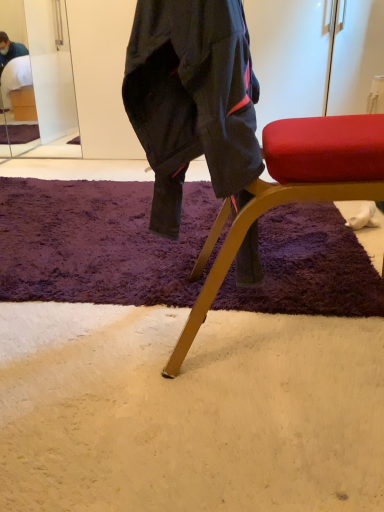
This screenshot has width=384, height=512. What do you see at coordinates (297, 188) in the screenshot?
I see `metallic gold chair at center` at bounding box center [297, 188].

Measure the distance between point (x=124, y=232) and camera.

They are 1.54 meters apart.

Locate an element on the screen. The image size is (384, 512). purple shaggy rug at center is located at coordinates (99, 243).

Measure the distance between point (36, 5) and camera.

Point (36, 5) is 2.97 meters from camera.

Find the location of a particular element. The height and width of the screenshot is (512, 384). metallic gold chair at center is located at coordinates (297, 188).

From the image's perspective, which object appears higher, clear glass mirror at upper left or metallic gold chair at center?

clear glass mirror at upper left, from the image's perspective.

Does clear glass mirror at upper left have a larger size compared to metallic gold chair at center?

No, clear glass mirror at upper left is not bigger than metallic gold chair at center.

Considering the relative sizes of clear glass mirror at upper left and metallic gold chair at center in the image provided, is clear glass mirror at upper left wider than metallic gold chair at center?

Incorrect, the width of clear glass mirror at upper left does not surpass that of metallic gold chair at center.

Based on the photo, can you tell me how much clear glass mirror at upper left and metallic gold chair at center differ in facing direction?

They differ by 93.3 degrees in their facing directions.

Considering the positions of points (379, 152) and (332, 268), is point (379, 152) closer to camera compared to point (332, 268)?

Yes.

Could purple shaggy rug at center be considered to be inside metallic gold chair at center?

No, purple shaggy rug at center is located outside of metallic gold chair at center.

Is metallic gold chair at center looking in the opposite direction of purple shaggy rug at center?

No, metallic gold chair at center is not facing away from purple shaggy rug at center.

From the image's perspective, which one is positioned lower, metallic gold chair at center or clear glass mirror at upper left?

metallic gold chair at center appears lower in the image.

Is metallic gold chair at center with clear glass mirror at upper left?

They are not placed beside each other.

From a real-world perspective, is metallic gold chair at center physically located above or below clear glass mirror at upper left?

From a real-world perspective, metallic gold chair at center is physically below clear glass mirror at upper left.

Which object is further away from the camera taking this photo, metallic gold chair at center or clear glass mirror at upper left?

clear glass mirror at upper left is further away from the camera.

Is clear glass mirror at upper left bigger than purple shaggy rug at center?

No, clear glass mirror at upper left is not bigger than purple shaggy rug at center.

Is the depth of clear glass mirror at upper left less than that of purple shaggy rug at center?

No, it is behind purple shaggy rug at center.

How many degrees apart are the facing directions of clear glass mirror at upper left and purple shaggy rug at center?

They differ by 1.28 degrees in their facing directions.

From the picture: Which is more to the left, purple shaggy rug at center or metallic gold chair at center?

From the viewer's perspective, purple shaggy rug at center appears more on the left side.

Is purple shaggy rug at center turned away from metallic gold chair at center?

No, purple shaggy rug at center is not facing the opposite direction of metallic gold chair at center.

From a real-world perspective, between purple shaggy rug at center and metallic gold chair at center, who is vertically higher?

metallic gold chair at center, from a real-world perspective.

Is purple shaggy rug at center beside clear glass mirror at upper left?

No, purple shaggy rug at center is not making contact with clear glass mirror at upper left.

Who is shorter, purple shaggy rug at center or clear glass mirror at upper left?

With less height is purple shaggy rug at center.

Which object is further away from the camera, purple shaggy rug at center or clear glass mirror at upper left?

clear glass mirror at upper left is behind.

Locate an element on the screen. The width and height of the screenshot is (384, 512). chair in front of the clear glass mirror at upper left is located at coordinates (297, 188).

Find the location of a particular element. The image size is (384, 512). mat behind the metallic gold chair at center is located at coordinates [x=99, y=243].

Based on their spatial positions, is metallic gold chair at center or clear glass mirror at upper left closer to purple shaggy rug at center?

metallic gold chair at center lies closer to purple shaggy rug at center than the other object.

Estimate the real-world distances between objects in this image. Which object is further from metallic gold chair at center, clear glass mirror at upper left or purple shaggy rug at center?

Based on the image, clear glass mirror at upper left appears to be further to metallic gold chair at center.

Estimate the real-world distances between objects in this image. Which object is further from clear glass mirror at upper left, purple shaggy rug at center or metallic gold chair at center?

Among the two, metallic gold chair at center is located further to clear glass mirror at upper left.

When comparing their distances from metallic gold chair at center, does purple shaggy rug at center or clear glass mirror at upper left seem closer?

Among the two, purple shaggy rug at center is located nearer to metallic gold chair at center.

From the image, which object appears to be nearer to clear glass mirror at upper left, metallic gold chair at center or purple shaggy rug at center?

Based on the image, purple shaggy rug at center appears to be nearer to clear glass mirror at upper left.

Estimate the real-world distances between objects in this image. Which object is further from purple shaggy rug at center, clear glass mirror at upper left or metallic gold chair at center?

clear glass mirror at upper left is further to purple shaggy rug at center.

I want to click on mat located between metallic gold chair at center and clear glass mirror at upper left in the depth direction, so click(x=99, y=243).